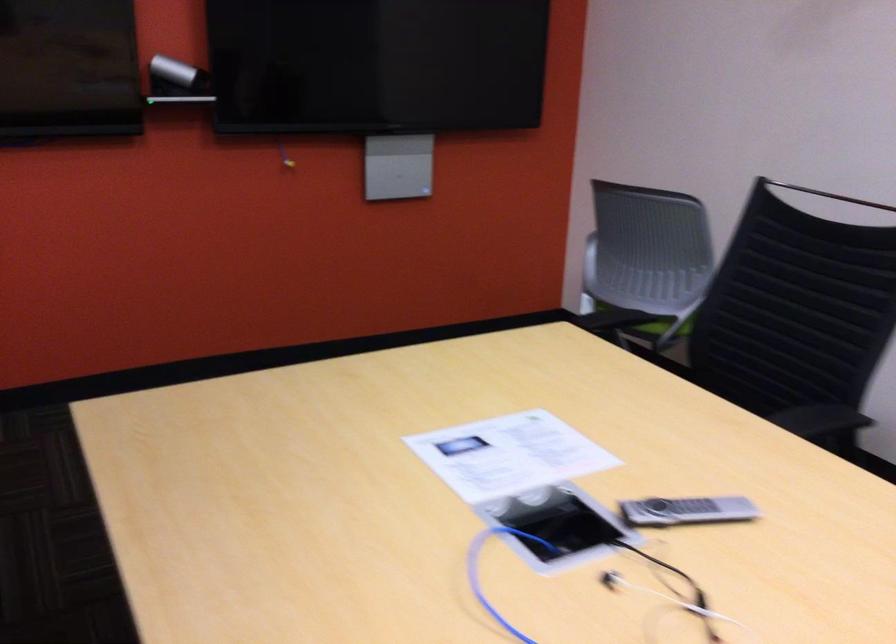
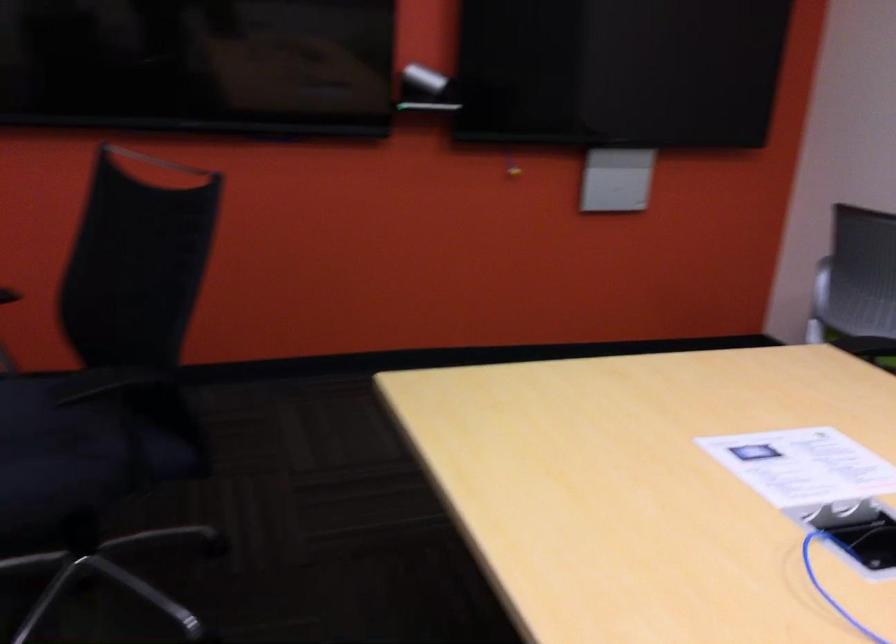
In the second image, find the point that corresponds to point (514, 444) in the first image.

(803, 466)